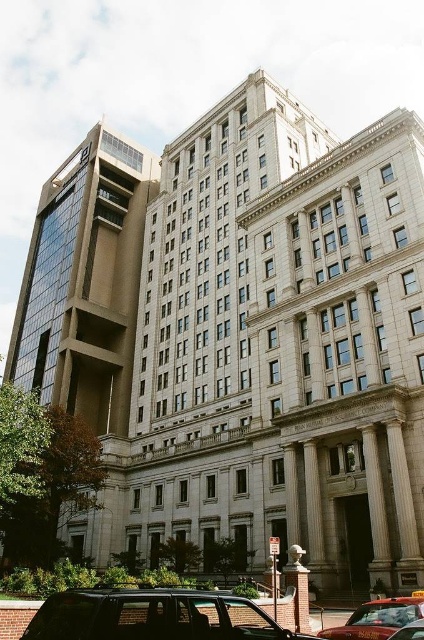
You are a pedestrian standing at the entrance of the classical building and want to hail a taxi. You see two taxis nearby, the red metallic taxi cab at lower center and the metallic silver taxi at lower right. Which taxi should you approach first if you want the closest one?

You should approach the red metallic taxi cab at lower center first because it is closer to you than the metallic silver taxi at lower right.

You are a pedestrian trying to cross the street between the two taxi cabs. The red metallic taxi cab at lower center and the metallic silver taxi at lower right are parked on the same side of the road. Which taxi cab is wider so you can choose the side with more space to walk around?

The red metallic taxi cab at lower center is wider than the metallic silver taxi at lower right, so you should choose to walk around the side of the red metallic taxi cab at lower center for more space.

You are a delivery driver who needs to park your vehicle in a tight space between two cars. You see a matte black suv at lower center and a red metallic taxi cab at lower center. Which vehicle should you avoid parking next to to ensure enough space?

You should avoid parking next to the matte black suv at lower center because it is larger than the red metallic taxi cab at lower center, leaving less space available for your vehicle.